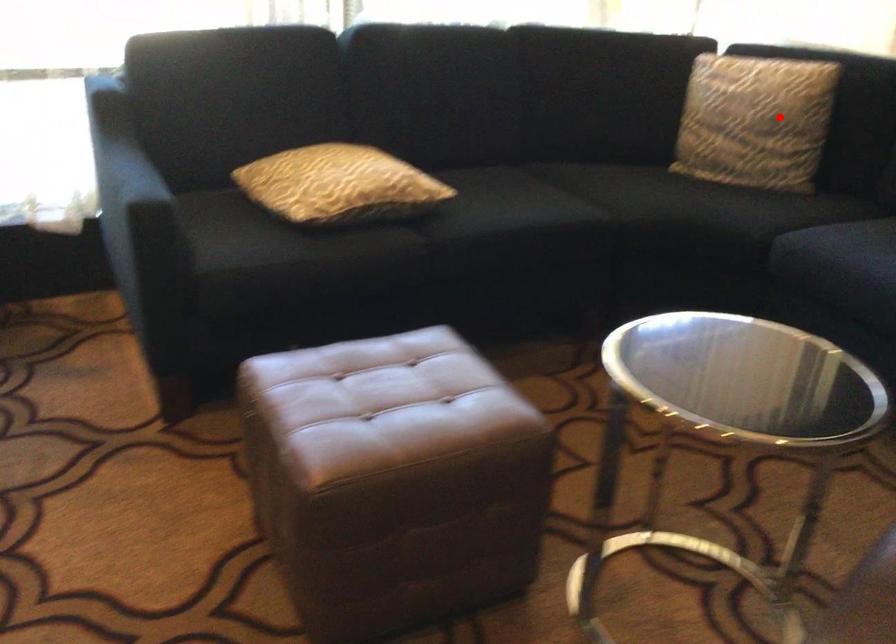
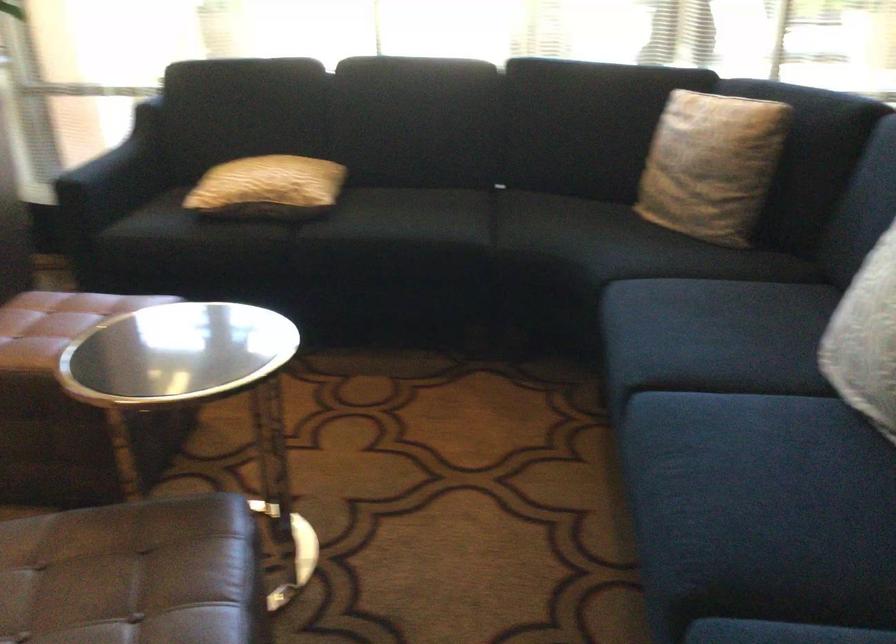
Find the pixel in the second image that matches the highlighted location in the first image.

(711, 165)